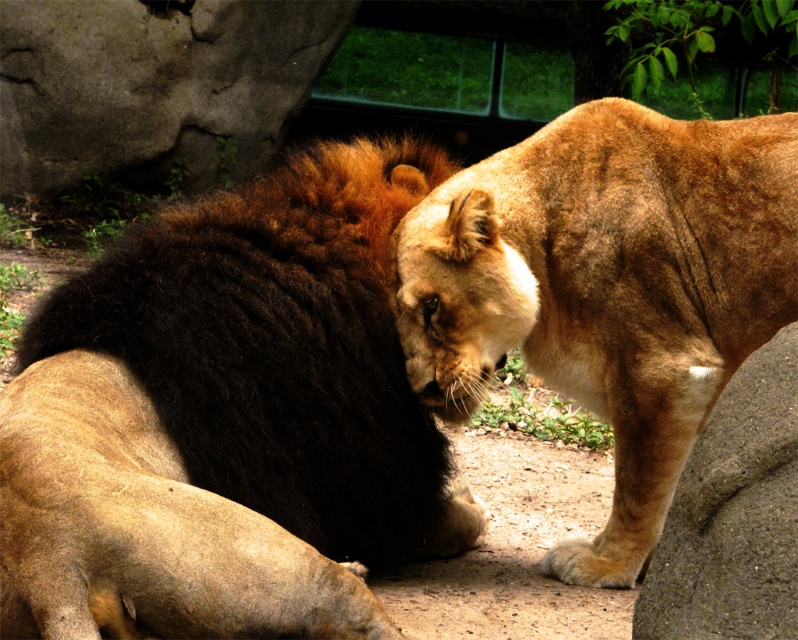
This screenshot has width=798, height=640. What do you see at coordinates (227, 419) in the screenshot?
I see `dark brown fur lion at center` at bounding box center [227, 419].

The image size is (798, 640). In order to click on dark brown fur lion at center in this screenshot , I will do `click(227, 419)`.